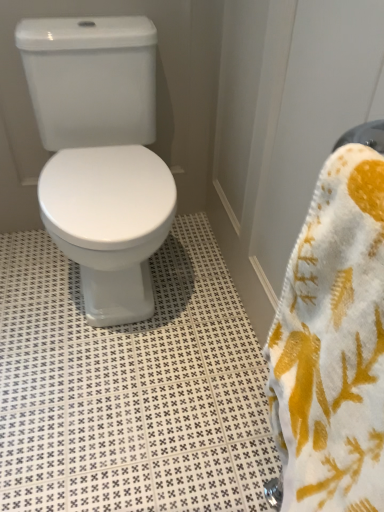
Question: From the image's perspective, is white soft towel at right positioned above or below white glossy toilet at center?

Choices:
 (A) above
 (B) below

Answer: (B)

Question: Is white soft towel at right bigger or smaller than white glossy toilet at center?

Choices:
 (A) small
 (B) big

Answer: (A)

Question: Which is nearer to the white glossy toilet at center?

Choices:
 (A) white soft towel at right
 (B) white textured tile at center

Answer: (B)

Question: Which of these objects is positioned farthest from the white glossy toilet at center?

Choices:
 (A) white textured tile at center
 (B) white soft towel at right

Answer: (B)